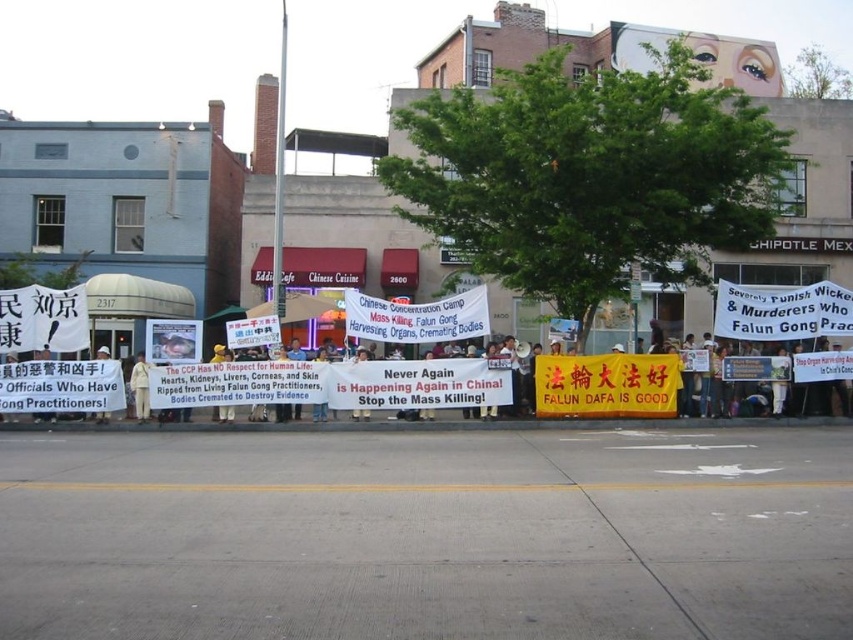
Looking at the protest scene, where is the light beige cotton shirt at center in relation to the white paper sign at center?

The light beige cotton shirt at center is to the right of the white paper sign at center.

You are a photographer at the protest scene. You want to take a photo that clearly shows both the light beige cotton shirt at center and the white paper sign at center. Based on their positions, which one should you focus on first to ensure both are in sharp focus?

The light beige cotton shirt at center is below the white paper sign at center. To ensure both are in sharp focus, you should focus on the white paper sign at center first, as it is farther away from the camera, and the depth of field will naturally include the closer light beige cotton shirt at center.

You are a photographer aiming to capture the protest scene. You notice the light beige cotton shirt at center and the white paper sign at center. Which object is wider when viewed from your camera lens?

The white paper sign at center is wider than the light beige cotton shirt at center.